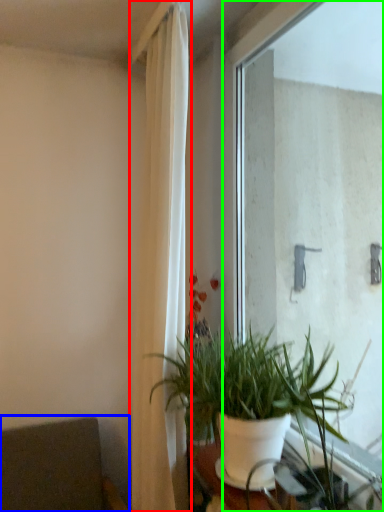
Question: Which object is the closest to the curtain (highlighted by a red box)? Choose among these: armchair (highlighted by a blue box) or window (highlighted by a green box).

Choices:
 (A) armchair
 (B) window

Answer: (A)